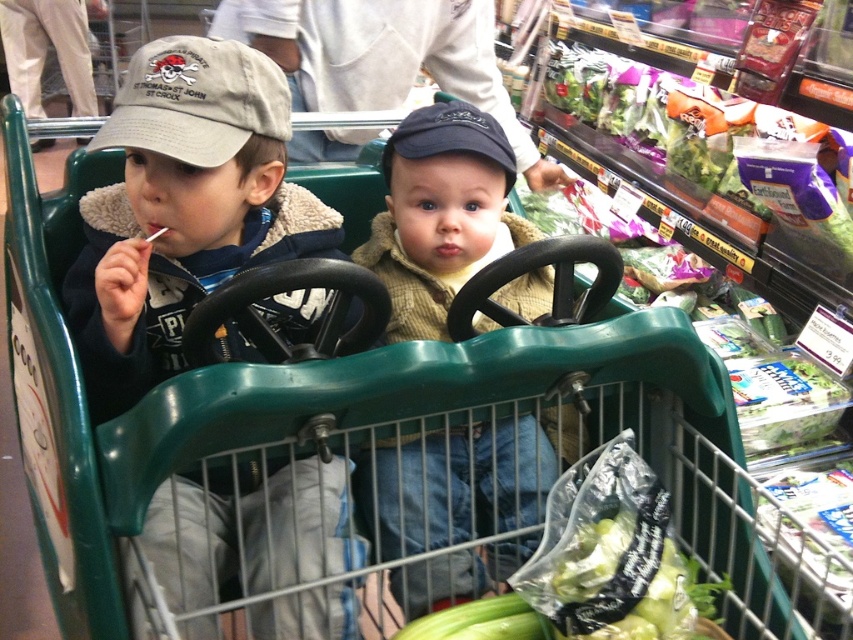
Question: Does matte khaki cap at center have a larger size compared to knitted beige sweater at center?

Choices:
 (A) no
 (B) yes

Answer: (B)

Question: Is matte khaki cap at center to the left of knitted beige sweater at center from the viewer's perspective?

Choices:
 (A) no
 (B) yes

Answer: (B)

Question: Which object appears farthest from the camera in this image?

Choices:
 (A) matte khaki cap at center
 (B) gray cotton baseball cap at upper left
 (C) green matte cucumber at lower center

Answer: (B)

Question: Among these points, which one is farthest from the camera?

Choices:
 (A) (387, 189)
 (B) (518, 616)
 (C) (212, 128)
 (D) (178, 547)

Answer: (A)

Question: Which object is closer to the camera taking this photo?

Choices:
 (A) knitted beige sweater at center
 (B) green matte cucumber at lower center

Answer: (B)

Question: Is matte khaki cap at center smaller than green matte cucumber at lower center?

Choices:
 (A) no
 (B) yes

Answer: (A)